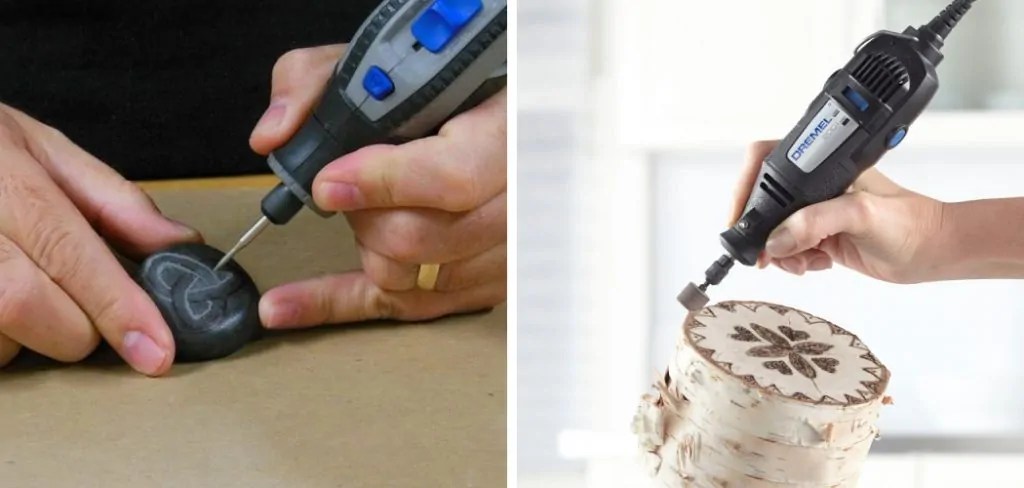
You are a GUI agent. You are given a task and a screenshot of the screen. Output one action in this format:
    pyautogui.click(x=<x>, y=<y>)
    Task: Click on the electrical cord
    
    Given the screenshot: What is the action you would take?
    pyautogui.click(x=958, y=9)